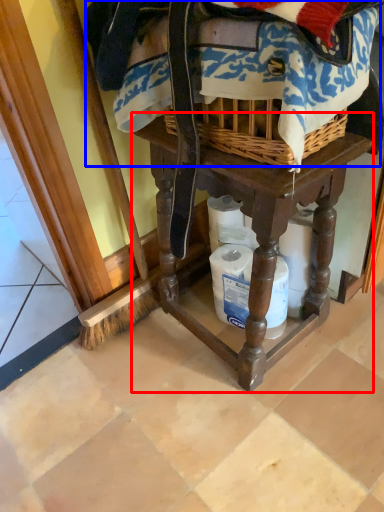
Question: Which point is closer to the camera, furniture (highlighted by a red box) or clothing (highlighted by a blue box)?

Choices:
 (A) furniture
 (B) clothing

Answer: (B)